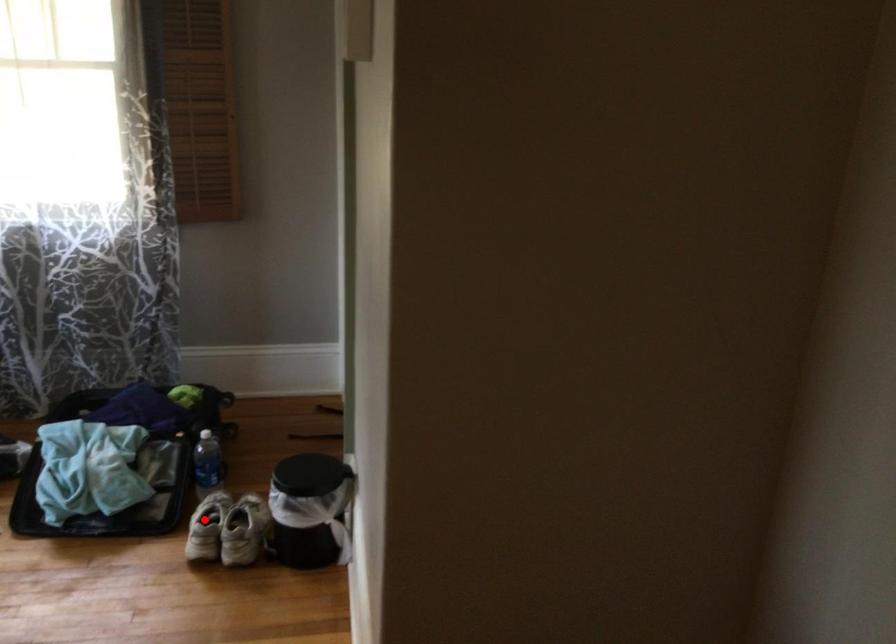
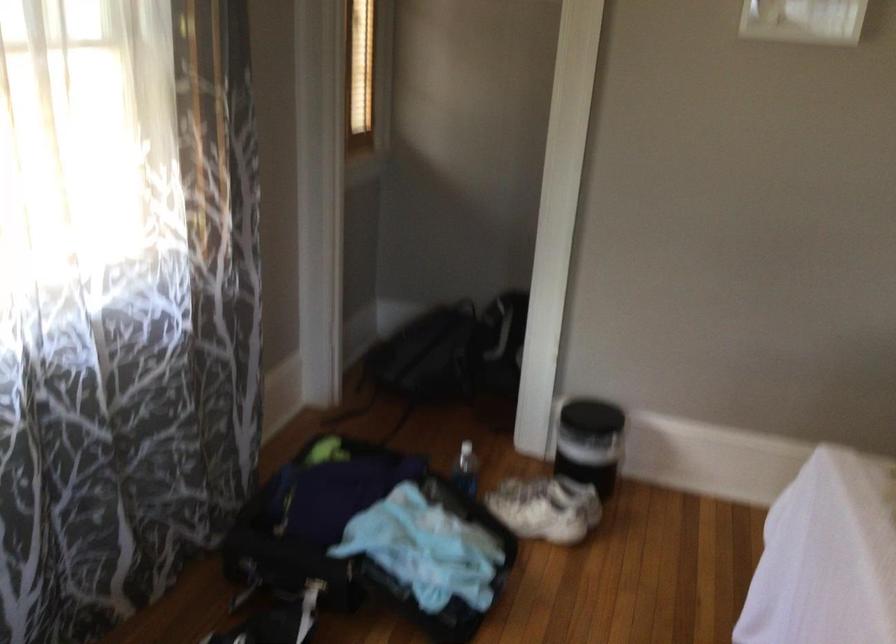
The point at the highlighted location is marked in the first image. Where is the corresponding point in the second image?

(546, 507)